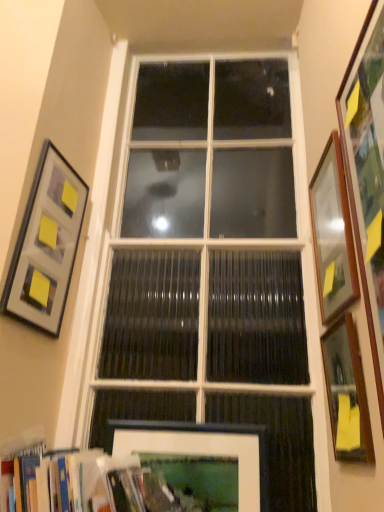
Describe the element at coordinates (202, 276) in the screenshot. This screenshot has width=384, height=512. I see `white glass window at center` at that location.

The width and height of the screenshot is (384, 512). What are the coordinates of `wooden picture frame at right, the 5th picture frame in the left-to-right sequence` in the screenshot? It's located at (332, 234).

How much space does wooden picture frame at right, the third picture frame when ordered from right to left, occupy horizontally?

The width of wooden picture frame at right, the third picture frame when ordered from right to left, is 2.03 inches.

What do you see at coordinates (46, 245) in the screenshot?
I see `matte gray picture frame at upper left, arranged as the 5th picture frame when viewed from the right` at bounding box center [46, 245].

This screenshot has height=512, width=384. In order to click on matte gray picture frame at upper left, arranged as the 5th picture frame when viewed from the right in this screenshot , I will do `click(46, 245)`.

Locate an element on the screen. white glass window at center is located at coordinates (202, 276).

From the image's perspective, which is below, wooden picture frame at right, the 5th picture frame in the left-to-right sequence, or white glass window at center?

wooden picture frame at right, the 5th picture frame in the left-to-right sequence, appears lower in the image.

Would you say wooden picture frame at right, the 5th picture frame in the left-to-right sequence, is outside white glass window at center?

Indeed, wooden picture frame at right, the 5th picture frame in the left-to-right sequence, is completely outside white glass window at center.

Considering the relative sizes of wooden picture frame at right, arranged as the first picture frame when viewed from the right, and white glass window at center in the image provided, is wooden picture frame at right, arranged as the first picture frame when viewed from the right, taller than white glass window at center?

No, wooden picture frame at right, arranged as the first picture frame when viewed from the right, is not taller than white glass window at center.

Are wooden picture frame at right, arranged as the first picture frame when viewed from the right, and white glass window at center making contact?

No, wooden picture frame at right, arranged as the first picture frame when viewed from the right, is not beside white glass window at center.

Who is smaller, wooden picture frame at right, arranged as the first picture frame when viewed from the right, or wooden picture frame at right, the third picture frame viewed from the left?

With smaller size is wooden picture frame at right, arranged as the first picture frame when viewed from the right.

Considering the positions of points (339, 274) and (363, 166), is point (339, 274) farther from camera compared to point (363, 166)?

Yes, it is behind point (363, 166).

Does wooden picture frame at right, arranged as the first picture frame when viewed from the right, turn towards wooden picture frame at right, the third picture frame when ordered from right to left?

No, wooden picture frame at right, arranged as the first picture frame when viewed from the right, is not aimed at wooden picture frame at right, the third picture frame when ordered from right to left.

Is wooden picture frame at right, the third picture frame when ordered from right to left, a part of wooden picture frame at right, arranged as the first picture frame when viewed from the right?

No, wooden picture frame at right, the third picture frame when ordered from right to left, is not a part of wooden picture frame at right, arranged as the first picture frame when viewed from the right.

Consider the image. Can you confirm if wooden framed mirror at right, the fourth picture frame in the left-to-right sequence, is wider than white matte picture frame at lower center, the 2th picture frame when ordered from left to right?

Yes, wooden framed mirror at right, the fourth picture frame in the left-to-right sequence, is wider than white matte picture frame at lower center, the 2th picture frame when ordered from left to right.

Looking at this image, from the image's perspective, is wooden framed mirror at right, the 2th picture frame viewed from the right, over white matte picture frame at lower center, which is counted as the fourth picture frame, starting from the right?

Yes.

Could you tell me if wooden framed mirror at right, the fourth picture frame in the left-to-right sequence, is turned towards white matte picture frame at lower center, the 2th picture frame when ordered from left to right?

No.

From the picture: From a real-world perspective, which is physically below, wooden framed mirror at right, the fourth picture frame in the left-to-right sequence, or white matte picture frame at lower center, the 2th picture frame when ordered from left to right?

white matte picture frame at lower center, the 2th picture frame when ordered from left to right.

Locate an element on the screen. window below the wooden picture frame at right, the third picture frame when ordered from right to left (from the image's perspective) is located at coordinates point(202,276).

Which is in front, wooden picture frame at right, the third picture frame when ordered from right to left, or white glass window at center?

wooden picture frame at right, the third picture frame when ordered from right to left, is more forward.

Can you tell me how much wooden picture frame at right, the third picture frame when ordered from right to left, and white glass window at center differ in facing direction?

The angle between the facing direction of wooden picture frame at right, the third picture frame when ordered from right to left, and the facing direction of white glass window at center is 89.2 degrees.

In the scene shown: Measure the distance from wooden picture frame at right, the third picture frame viewed from the left, to white glass window at center.

A distance of 25.21 inches exists between wooden picture frame at right, the third picture frame viewed from the left, and white glass window at center.

Is wooden picture frame at right, arranged as the first picture frame when viewed from the right, in contact with white matte picture frame at lower center, the 2th picture frame when ordered from left to right?

They are not placed beside each other.

How different are the orientations of wooden picture frame at right, the 5th picture frame in the left-to-right sequence, and white matte picture frame at lower center, the 2th picture frame when ordered from left to right, in degrees?

wooden picture frame at right, the 5th picture frame in the left-to-right sequence, and white matte picture frame at lower center, the 2th picture frame when ordered from left to right, are facing 89.9 degrees away from each other.

Find the location of `the 3rd picture frame to the right of the white matte picture frame at lower center, which is counted as the fourth picture frame, starting from the right, counting from the anchor's position`. the 3rd picture frame to the right of the white matte picture frame at lower center, which is counted as the fourth picture frame, starting from the right, counting from the anchor's position is located at coordinates (332, 234).

Visually, is wooden picture frame at right, arranged as the first picture frame when viewed from the right, positioned to the left or to the right of white matte picture frame at lower center, the 2th picture frame when ordered from left to right?

wooden picture frame at right, arranged as the first picture frame when viewed from the right, is positioned on white matte picture frame at lower center, the 2th picture frame when ordered from left to right,'s right side.

From the image's perspective, which picture frame is the 2nd one above the white matte picture frame at lower center, the 2th picture frame when ordered from left to right? Please provide its 2D coordinates.

[(46, 245)]

Considering their positions, is matte gray picture frame at upper left, the first picture frame positioned from the left, located in front of or behind white matte picture frame at lower center, the 2th picture frame when ordered from left to right?

Visually, matte gray picture frame at upper left, the first picture frame positioned from the left, is located in front of white matte picture frame at lower center, the 2th picture frame when ordered from left to right.

From a real-world perspective, is matte gray picture frame at upper left, arranged as the 5th picture frame when viewed from the right, physically above white matte picture frame at lower center, which is counted as the fourth picture frame, starting from the right?

Yes, from a real-world perspective, matte gray picture frame at upper left, arranged as the 5th picture frame when viewed from the right, is on top of white matte picture frame at lower center, which is counted as the fourth picture frame, starting from the right.

Measure the distance between matte gray picture frame at upper left, arranged as the 5th picture frame when viewed from the right, and white matte picture frame at lower center, the 2th picture frame when ordered from left to right.

matte gray picture frame at upper left, arranged as the 5th picture frame when viewed from the right, is 21.93 inches from white matte picture frame at lower center, the 2th picture frame when ordered from left to right.

At what (x,y) coordinates should I click in order to perform the action: click on picture frame that is the 1st object directly below the white glass window at center (from a real-world perspective). Please return your answer as a coordinate pair (x, y). This screenshot has height=512, width=384. Looking at the image, I should click on (46, 245).

Can you confirm if white glass window at center is shorter than matte gray picture frame at upper left, the first picture frame positioned from the left?

No.

Is white glass window at center inside or outside of matte gray picture frame at upper left, the first picture frame positioned from the left?

The correct answer is: outside.

What's the angular difference between white glass window at center and matte gray picture frame at upper left, arranged as the 5th picture frame when viewed from the right,'s facing directions?

There is a 77.4-degree angle between the facing directions of white glass window at center and matte gray picture frame at upper left, arranged as the 5th picture frame when viewed from the right.

You are a GUI agent. You are given a task and a screenshot of the screen. Output one action in this format:
    pyautogui.click(x=<x>, y=<y>)
    Task: Click on the window that appears above the wooden picture frame at right, arranged as the first picture frame when viewed from the right (from a real-world perspective)
    Image resolution: width=384 pixels, height=512 pixels.
    Given the screenshot: What is the action you would take?
    pyautogui.click(x=202, y=276)

You are a GUI agent. You are given a task and a screenshot of the screen. Output one action in this format:
    pyautogui.click(x=<x>, y=<y>)
    Task: Click on the picture frame that is the 1st one when counting downward from the wooden picture frame at right, the third picture frame when ordered from right to left (from the image's perspective)
    
    Given the screenshot: What is the action you would take?
    pyautogui.click(x=332, y=234)

Based on their spatial positions, is white matte picture frame at lower center, which is counted as the fourth picture frame, starting from the right, or white glass window at center further from matte gray picture frame at upper left, arranged as the 5th picture frame when viewed from the right?

Among the two, white matte picture frame at lower center, which is counted as the fourth picture frame, starting from the right, is located further to matte gray picture frame at upper left, arranged as the 5th picture frame when viewed from the right.

When comparing their distances from wooden picture frame at right, the 5th picture frame in the left-to-right sequence, does wooden framed mirror at right, the 2th picture frame viewed from the right, or wooden picture frame at right, the third picture frame viewed from the left, seem further?

The object further to wooden picture frame at right, the 5th picture frame in the left-to-right sequence, is wooden framed mirror at right, the 2th picture frame viewed from the right.

Looking at the image, which one is located closer to wooden bookshelf at lower left, wooden framed mirror at right, the fourth picture frame in the left-to-right sequence, or white glass window at center?

Based on the image, wooden framed mirror at right, the fourth picture frame in the left-to-right sequence, appears to be nearer to wooden bookshelf at lower left.

Considering their positions, is wooden picture frame at right, the 5th picture frame in the left-to-right sequence, positioned closer to wooden framed mirror at right, the 2th picture frame viewed from the right, than white glass window at center?

wooden picture frame at right, the 5th picture frame in the left-to-right sequence, lies closer to wooden framed mirror at right, the 2th picture frame viewed from the right, than the other object.

Based on their spatial positions, is wooden bookshelf at lower left or wooden framed mirror at right, the 2th picture frame viewed from the right, closer to wooden picture frame at right, the third picture frame viewed from the left?

wooden framed mirror at right, the 2th picture frame viewed from the right.

Looking at the image, which one is located further to matte gray picture frame at upper left, the first picture frame positioned from the left, wooden bookshelf at lower left or white matte picture frame at lower center, the 2th picture frame when ordered from left to right?

white matte picture frame at lower center, the 2th picture frame when ordered from left to right, is further to matte gray picture frame at upper left, the first picture frame positioned from the left.

Based on their spatial positions, is wooden picture frame at right, the third picture frame when ordered from right to left, or matte gray picture frame at upper left, arranged as the 5th picture frame when viewed from the right, further from wooden picture frame at right, the 5th picture frame in the left-to-right sequence?

Among the two, matte gray picture frame at upper left, arranged as the 5th picture frame when viewed from the right, is located further to wooden picture frame at right, the 5th picture frame in the left-to-right sequence.

When comparing their distances from wooden picture frame at right, the third picture frame when ordered from right to left, does white glass window at center or matte gray picture frame at upper left, the first picture frame positioned from the left, seem further?

Among the two, matte gray picture frame at upper left, the first picture frame positioned from the left, is located further to wooden picture frame at right, the third picture frame when ordered from right to left.

Where is `bookcase between matte gray picture frame at upper left, arranged as the 5th picture frame when viewed from the right, and wooden framed mirror at right, the fourth picture frame in the left-to-right sequence, in the horizontal direction`? The height and width of the screenshot is (512, 384). bookcase between matte gray picture frame at upper left, arranged as the 5th picture frame when viewed from the right, and wooden framed mirror at right, the fourth picture frame in the left-to-right sequence, in the horizontal direction is located at coordinates (81, 484).

What are the coordinates of `bookcase between wooden picture frame at right, the 5th picture frame in the left-to-right sequence, and white matte picture frame at lower center, which is counted as the fourth picture frame, starting from the right, vertically` in the screenshot? It's located at coord(81,484).

This screenshot has height=512, width=384. What are the coordinates of `bookcase located between matte gray picture frame at upper left, arranged as the 5th picture frame when viewed from the right, and wooden picture frame at right, the third picture frame viewed from the left, in the left-right direction` in the screenshot? It's located at [81, 484].

What are the coordinates of `bookcase between wooden picture frame at right, the third picture frame viewed from the left, and white matte picture frame at lower center, the 2th picture frame when ordered from left to right, in the vertical direction` in the screenshot? It's located at (81, 484).